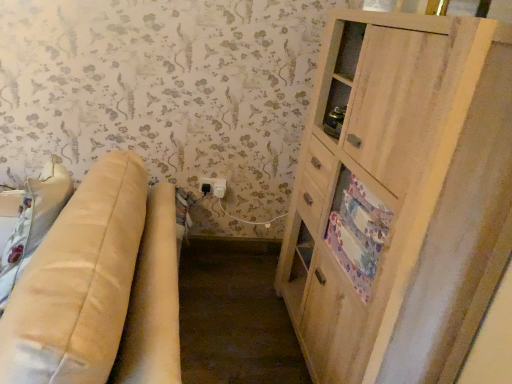
Question: Can you confirm if beige leather couch at left is bigger than light wood cabinet at right?

Choices:
 (A) no
 (B) yes

Answer: (B)

Question: Does beige leather couch at left turn towards light wood cabinet at right?

Choices:
 (A) no
 (B) yes

Answer: (A)

Question: From the image's perspective, does beige leather couch at left appear lower than light wood cabinet at right?

Choices:
 (A) no
 (B) yes

Answer: (B)

Question: Can you confirm if beige leather couch at left is shorter than light wood cabinet at right?

Choices:
 (A) yes
 (B) no

Answer: (A)

Question: Is light wood cabinet at right surrounded by beige leather couch at left?

Choices:
 (A) no
 (B) yes

Answer: (A)

Question: Is light wood cabinet at right inside or outside of beige leather couch at left?

Choices:
 (A) inside
 (B) outside

Answer: (B)

Question: From the image's perspective, is light wood cabinet at right above or below beige leather couch at left?

Choices:
 (A) above
 (B) below

Answer: (A)

Question: Does point (347, 380) appear closer or farther from the camera than point (75, 201)?

Choices:
 (A) farther
 (B) closer

Answer: (A)

Question: Considering the positions of light wood cabinet at right and beige leather couch at left in the image, is light wood cabinet at right taller or shorter than beige leather couch at left?

Choices:
 (A) short
 (B) tall

Answer: (B)

Question: From the image's perspective, is floral fabric drawer at right above or below light wood cabinet at right?

Choices:
 (A) below
 (B) above

Answer: (A)

Question: Considering their positions, is floral fabric drawer at right located in front of or behind light wood cabinet at right?

Choices:
 (A) front
 (B) behind

Answer: (B)

Question: Is floral fabric drawer at right inside the boundaries of light wood cabinet at right, or outside?

Choices:
 (A) inside
 (B) outside

Answer: (A)

Question: Visually, is floral fabric drawer at right positioned to the left or to the right of light wood cabinet at right?

Choices:
 (A) left
 (B) right

Answer: (A)

Question: Is point (350, 264) closer or farther from the camera than point (104, 299)?

Choices:
 (A) closer
 (B) farther

Answer: (B)

Question: Considering the positions of floral fabric drawer at right and beige leather couch at left in the image, is floral fabric drawer at right wider or thinner than beige leather couch at left?

Choices:
 (A) thin
 (B) wide

Answer: (A)